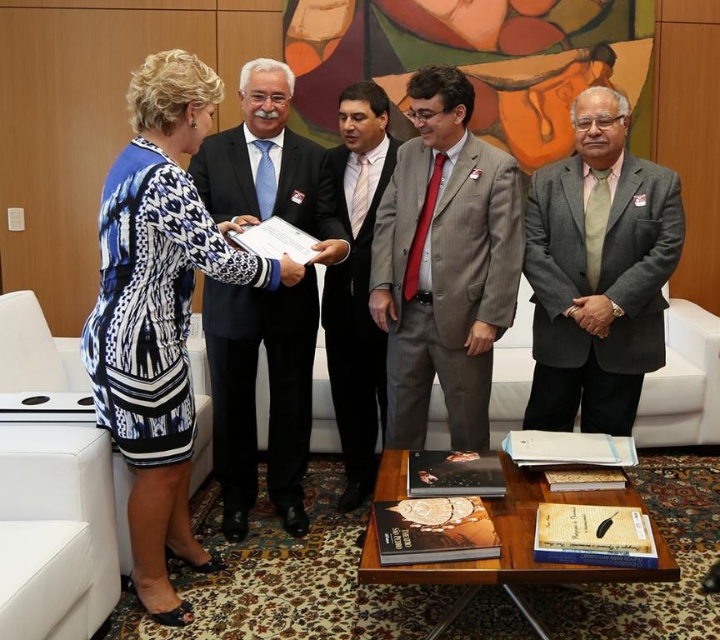
Which is more to the left, gray pinstripe suit at center or gray wool suit at center?

gray wool suit at center is more to the left.

Describe the element at coordinates (445, 284) in the screenshot. The width and height of the screenshot is (720, 640). I see `gray pinstripe suit at center` at that location.

Who is more distant from viewer, (505, 220) or (346, 419)?

Positioned behind is point (346, 419).

Find the location of `gray pinstripe suit at center`. gray pinstripe suit at center is located at coordinates (445, 284).

Which of these two, gray wool suit at right or gray wool suit at center, stands shorter?

With less height is gray wool suit at right.

Locate an element on the screen. gray wool suit at right is located at coordinates (598, 273).

Which is more to the right, blue printed dress at left or gray pinstripe suit at center?

gray pinstripe suit at center

Is blue printed dress at left below gray pinstripe suit at center?

Yes, blue printed dress at left is below gray pinstripe suit at center.

Is point (176, 339) less distant than point (469, 157)?

Yes, point (176, 339) is in front of point (469, 157).

At what (x,y) coordinates should I click in order to perform the action: click on blue printed dress at left. Please return your answer as a coordinate pair (x, y). Looking at the image, I should click on (158, 310).